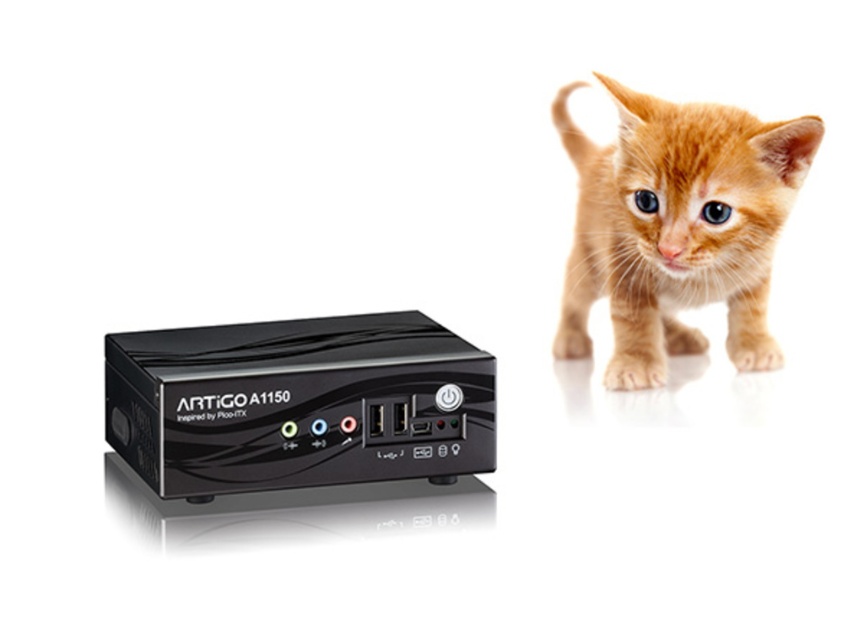
You are a photographer setting up a studio shoot. You have a black plastic artigo a1150 at left and an orange fur kitten at upper right. Which object should you focus on first if you want to capture both in a single frame without moving the camera? Explain your reasoning based on their sizes.

The black plastic artigo a1150 at left is smaller than the orange fur kitten at upper right. Since the kitten is larger, it might require more attention in the composition. However, focusing on the smaller device first could ensure its details are sharp, then adjust to include the kitten. Alternatively, using a mid focal point between both might balance the focus for both sizes.

You are a delivery person who needs to place a package between the black plastic artigo a1150 at left and the orange fur kitten at upper right. The package is 18 inches long. Will it fit in the space between them?

The black plastic artigo a1150 at left and orange fur kitten at upper right are 18.51 inches apart. Since the package is 18 inches long, it will fit in the space between them as there is enough room.